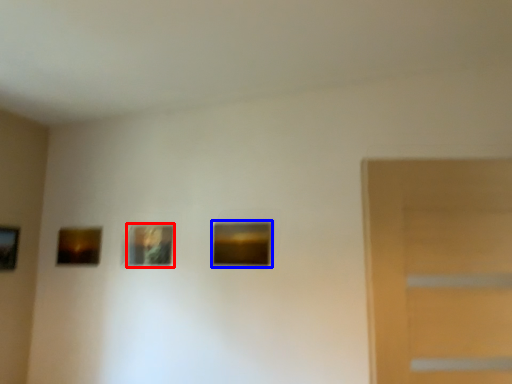
Question: Among these objects, which one is farthest to the camera, picture frame (highlighted by a red box) or picture frame (highlighted by a blue box)?

Choices:
 (A) picture frame
 (B) picture frame

Answer: (A)